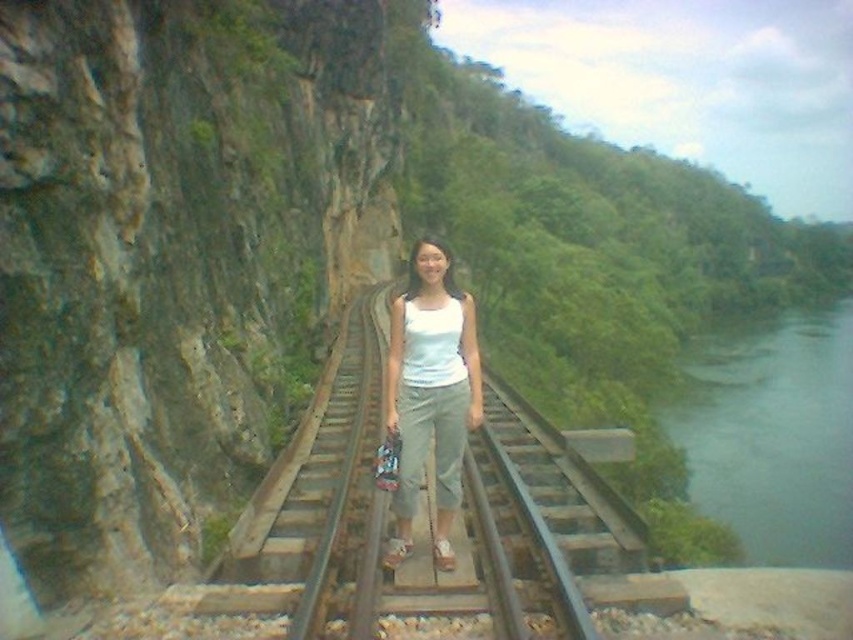
Between point (711, 448) and point (428, 324), which one is positioned behind?

The point (711, 448) is more distant.

Can you confirm if green water at right is positioned to the right of white cotton tank top at center?

Indeed, green water at right is positioned on the right side of white cotton tank top at center.

Between point (802, 556) and point (422, 445), which one is positioned behind?

Positioned behind is point (802, 556).

Find the location of `green water at right`. green water at right is located at coordinates (770, 433).